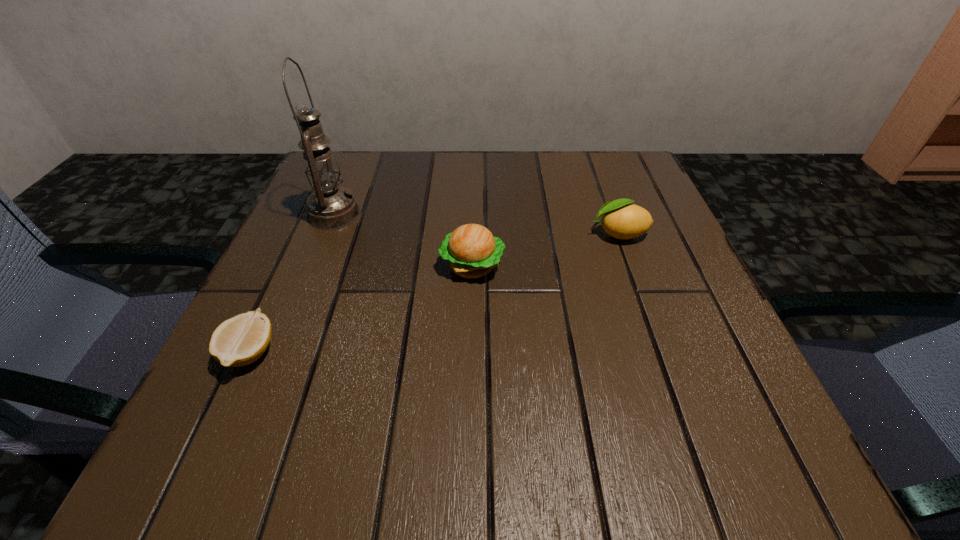
Where is `free spot at the left edge of the desktop`? free spot at the left edge of the desktop is located at coordinates (302, 238).

Find the location of a particular element. The image size is (960, 540). free space at the right edge of the desktop is located at coordinates (682, 280).

What are the coordinates of `free space between the nearest object and the oil lamp` in the screenshot? It's located at (292, 283).

Find the location of a particular element. free area in between the second nearest object and the oil lamp is located at coordinates (403, 240).

Identify the location of free area in between the left lemon and the taller lemon. The width and height of the screenshot is (960, 540). (435, 293).

You are a GUI agent. You are given a task and a screenshot of the screen. Output one action in this format:
    pyautogui.click(x=<x>, y=<y>)
    Task: Click on the free space between the shortest object and the right lemon
    
    Given the screenshot: What is the action you would take?
    pyautogui.click(x=435, y=293)

The image size is (960, 540). I want to click on unoccupied position between the tallest object and the rightmost object, so click(476, 224).

What are the coordinates of `free space between the rightmost object and the left lemon` in the screenshot? It's located at tap(435, 293).

The image size is (960, 540). I want to click on unoccupied position between the hamburger and the tallest object, so click(403, 240).

This screenshot has height=540, width=960. I want to click on vacant space in between the hamburger and the farther lemon, so click(545, 250).